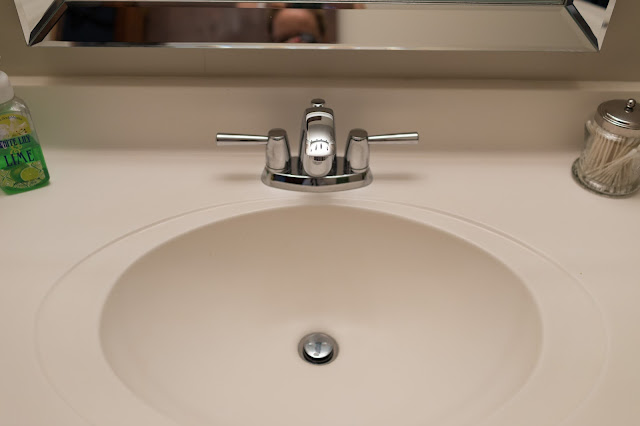
Where is `sink`? This screenshot has height=426, width=640. sink is located at coordinates (313, 303).